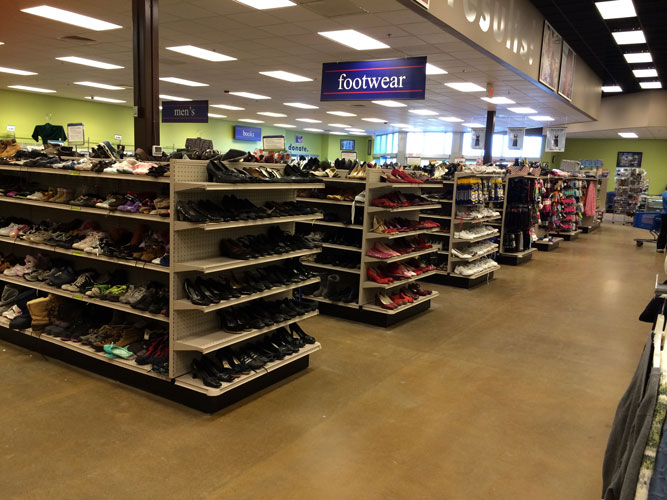
Where is `windows`? windows is located at coordinates (429, 141), (375, 141), (508, 150).